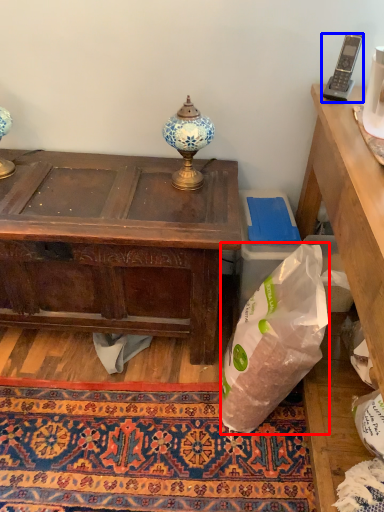
Question: Which of the following is the closest to the observer, plastic bag (highlighted by a red box) or corded phone (highlighted by a blue box)?

Choices:
 (A) plastic bag
 (B) corded phone

Answer: (A)